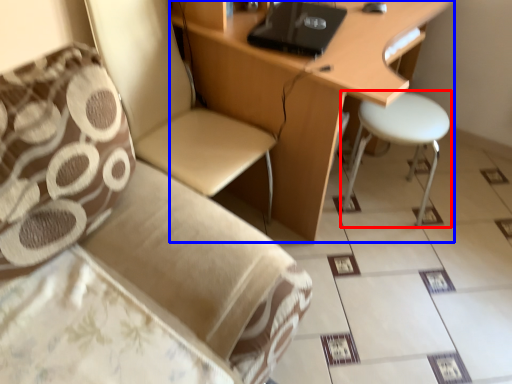
Question: Among these objects, which one is nearest to the camera, stool (highlighted by a red box) or desk (highlighted by a blue box)?

Choices:
 (A) stool
 (B) desk

Answer: (B)